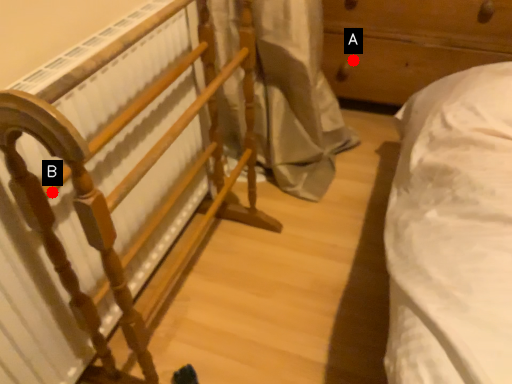
Question: Two points are circled on the image, labeled by A and B beside each circle. Which point is closer to the camera?

Choices:
 (A) A is closer
 (B) B is closer

Answer: (B)